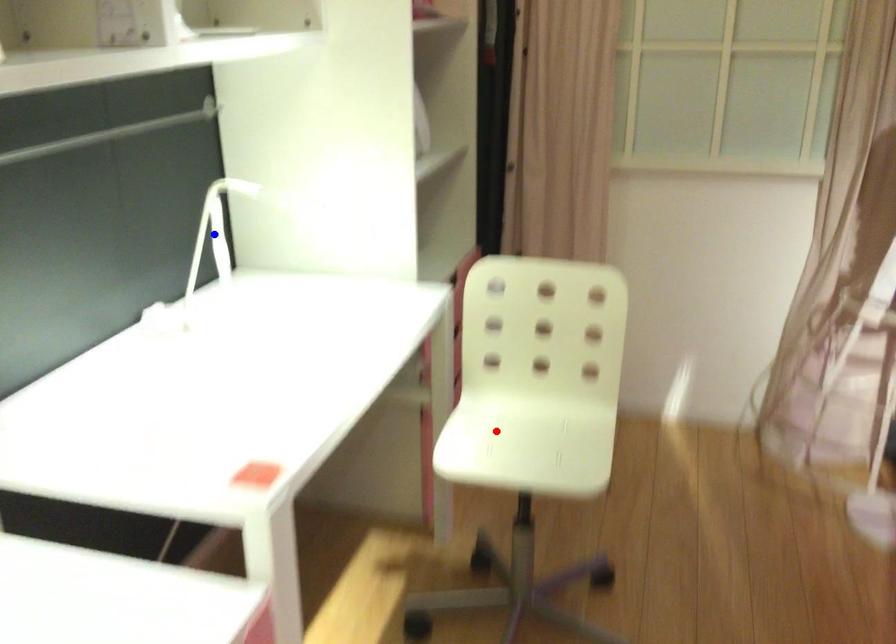
Question: Two points are marked on the image. Which point is closer to the camera?

Choices:
 (A) Blue point is closer.
 (B) Red point is closer.

Answer: (A)